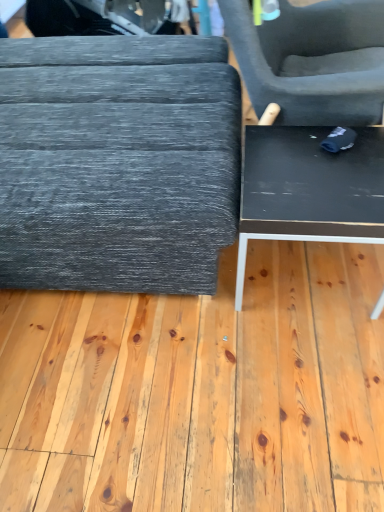
The height and width of the screenshot is (512, 384). I want to click on black matte plywood at center, so click(200, 391).

This screenshot has height=512, width=384. What are the coordinates of `black glossy table at lower right, the 2th table positioned from the left` in the screenshot? It's located at (309, 189).

What are the coordinates of `black matte plywood at center` in the screenshot? It's located at (200, 391).

From a real-world perspective, is matte gray ottoman at left, acting as the 2th table starting from the right, located beneath black matte plywood at center?

No, from a real-world perspective, matte gray ottoman at left, acting as the 2th table starting from the right, is not beneath black matte plywood at center.

Identify the location of table in front of the black matte plywood at center. (117, 162).

Is matte gray ottoman at left, acting as the 2th table starting from the right, directly adjacent to black matte plywood at center?

matte gray ottoman at left, acting as the 2th table starting from the right, and black matte plywood at center are clearly separated.

In the scene shown: Is matte gray ottoman at left, acting as the 2th table starting from the right, inside the boundaries of black matte plywood at center, or outside?

matte gray ottoman at left, acting as the 2th table starting from the right, cannot be found inside black matte plywood at center.

Considering the sizes of black matte plywood at center and matte gray ottoman at left, the 1th table viewed from the left, in the image, is black matte plywood at center taller or shorter than matte gray ottoman at left, the 1th table viewed from the left,?

Clearly, black matte plywood at center is shorter compared to matte gray ottoman at left, the 1th table viewed from the left.

Which object is positioned more to the left, black matte plywood at center or matte gray ottoman at left, the 1th table viewed from the left?

From the viewer's perspective, matte gray ottoman at left, the 1th table viewed from the left, appears more on the left side.

From a real-world perspective, is black matte plywood at center physically located above or below matte gray ottoman at left, acting as the 2th table starting from the right?

black matte plywood at center is situated lower than matte gray ottoman at left, acting as the 2th table starting from the right, in the real world.

Can you confirm if black matte plywood at center is bigger than matte gray ottoman at left, the 1th table viewed from the left?

No.

Is the surface of black matte plywood at center in direct contact with black glossy table at lower right, arranged as the first table when viewed from the right?

black matte plywood at center and black glossy table at lower right, arranged as the first table when viewed from the right, are clearly separated.

Is black matte plywood at center aimed at black glossy table at lower right, arranged as the first table when viewed from the right?

No, black matte plywood at center is not aimed at black glossy table at lower right, arranged as the first table when viewed from the right.

Considering the sizes of black matte plywood at center and black glossy table at lower right, the 2th table positioned from the left, in the image, is black matte plywood at center taller or shorter than black glossy table at lower right, the 2th table positioned from the left,?

Considering their sizes, black matte plywood at center has less height than black glossy table at lower right, the 2th table positioned from the left.

Is black matte plywood at center in front of or behind black glossy table at lower right, arranged as the first table when viewed from the right, in the image?

Visually, black matte plywood at center is located in front of black glossy table at lower right, arranged as the first table when viewed from the right.

Can you confirm if matte gray ottoman at left, acting as the 2th table starting from the right, is bigger than black glossy table at lower right, the 2th table positioned from the left?

Correct, matte gray ottoman at left, acting as the 2th table starting from the right, is larger in size than black glossy table at lower right, the 2th table positioned from the left.

From the picture: Does matte gray ottoman at left, acting as the 2th table starting from the right, have a lesser height compared to black glossy table at lower right, the 2th table positioned from the left?

No.

Which object is closer to the camera taking this photo, matte gray ottoman at left, the 1th table viewed from the left, or black glossy table at lower right, arranged as the first table when viewed from the right?

matte gray ottoman at left, the 1th table viewed from the left, is closer to the camera.

In the scene shown: From a real-world perspective, which object stands above the other?

In real-world perspective, matte gray ottoman at left, acting as the 2th table starting from the right, is above.

Identify the location of table on the right of matte gray ottoman at left, the 1th table viewed from the left. (309, 189).

From the image's perspective, which one is positioned higher, black glossy table at lower right, arranged as the first table when viewed from the right, or matte gray ottoman at left, the 1th table viewed from the left?

matte gray ottoman at left, the 1th table viewed from the left, is shown above in the image.

Does black glossy table at lower right, arranged as the first table when viewed from the right, have a smaller size compared to matte gray ottoman at left, the 1th table viewed from the left?

Indeed, black glossy table at lower right, arranged as the first table when viewed from the right, has a smaller size compared to matte gray ottoman at left, the 1th table viewed from the left.

Could black matte plywood at center be considered to be inside black glossy table at lower right, arranged as the first table when viewed from the right?

No, black matte plywood at center is located outside of black glossy table at lower right, arranged as the first table when viewed from the right.

Is black glossy table at lower right, the 2th table positioned from the left, smaller than black matte plywood at center?

Correct, black glossy table at lower right, the 2th table positioned from the left, occupies less space than black matte plywood at center.

Is point (290, 139) farther from camera compared to point (229, 447)?

Yes.

From the image's perspective, who appears lower, black glossy table at lower right, the 2th table positioned from the left, or black matte plywood at center?

black glossy table at lower right, the 2th table positioned from the left, from the image's perspective.

Where is `plywood behind the matte gray ottoman at left, the 1th table viewed from the left`? Image resolution: width=384 pixels, height=512 pixels. plywood behind the matte gray ottoman at left, the 1th table viewed from the left is located at coordinates (200, 391).

Locate an element on the screen. table that is in front of the black matte plywood at center is located at coordinates (117, 162).

From the image, which object appears to be farther from black glossy table at lower right, the 2th table positioned from the left, black matte plywood at center or matte gray ottoman at left, acting as the 2th table starting from the right?

black matte plywood at center lies further to black glossy table at lower right, the 2th table positioned from the left, than the other object.

From the picture: Looking at the image, which one is located further to black matte plywood at center, black glossy table at lower right, arranged as the first table when viewed from the right, or matte gray ottoman at left, the 1th table viewed from the left?

black glossy table at lower right, arranged as the first table when viewed from the right, is further to black matte plywood at center.

When comparing their distances from matte gray ottoman at left, the 1th table viewed from the left, does black matte plywood at center or black glossy table at lower right, the 2th table positioned from the left, seem further?

The object further to matte gray ottoman at left, the 1th table viewed from the left, is black matte plywood at center.

Based on their spatial positions, is black glossy table at lower right, the 2th table positioned from the left, or black matte plywood at center closer to matte gray ottoman at left, acting as the 2th table starting from the right?

Based on the image, black glossy table at lower right, the 2th table positioned from the left, appears to be nearer to matte gray ottoman at left, acting as the 2th table starting from the right.

Looking at the image, which one is located closer to black glossy table at lower right, arranged as the first table when viewed from the right, matte gray ottoman at left, acting as the 2th table starting from the right, or black matte plywood at center?

Based on the image, matte gray ottoman at left, acting as the 2th table starting from the right, appears to be nearer to black glossy table at lower right, arranged as the first table when viewed from the right.

From the image, which object appears to be farther from black matte plywood at center, matte gray ottoman at left, the 1th table viewed from the left, or black glossy table at lower right, the 2th table positioned from the left?

black glossy table at lower right, the 2th table positioned from the left, lies further to black matte plywood at center than the other object.

The image size is (384, 512). I want to click on plywood between matte gray ottoman at left, the 1th table viewed from the left, and black glossy table at lower right, the 2th table positioned from the left, so click(200, 391).